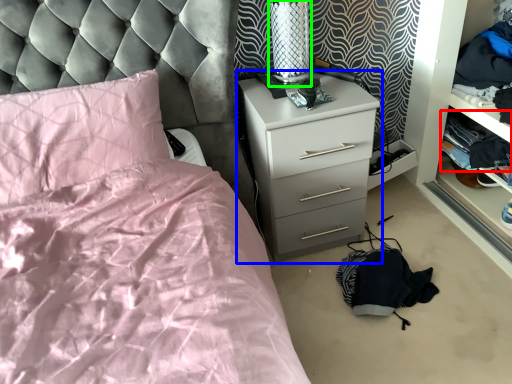
Question: Which object is positioned farthest from clothing (highlighted by a red box)? Select from chest of drawers (highlighted by a blue box) and table lamp (highlighted by a green box).

Choices:
 (A) chest of drawers
 (B) table lamp

Answer: (B)